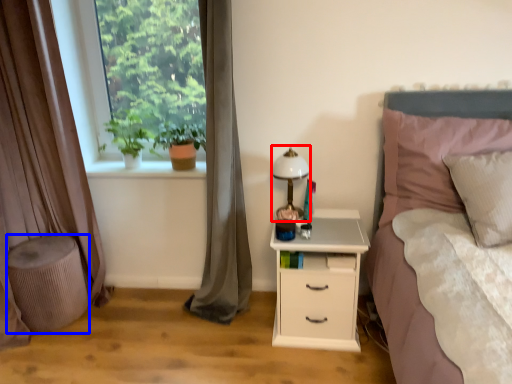
Question: Which point is closer to the camera, bedside lamp (highlighted by a red box) or stool (highlighted by a blue box)?

Choices:
 (A) bedside lamp
 (B) stool

Answer: (A)